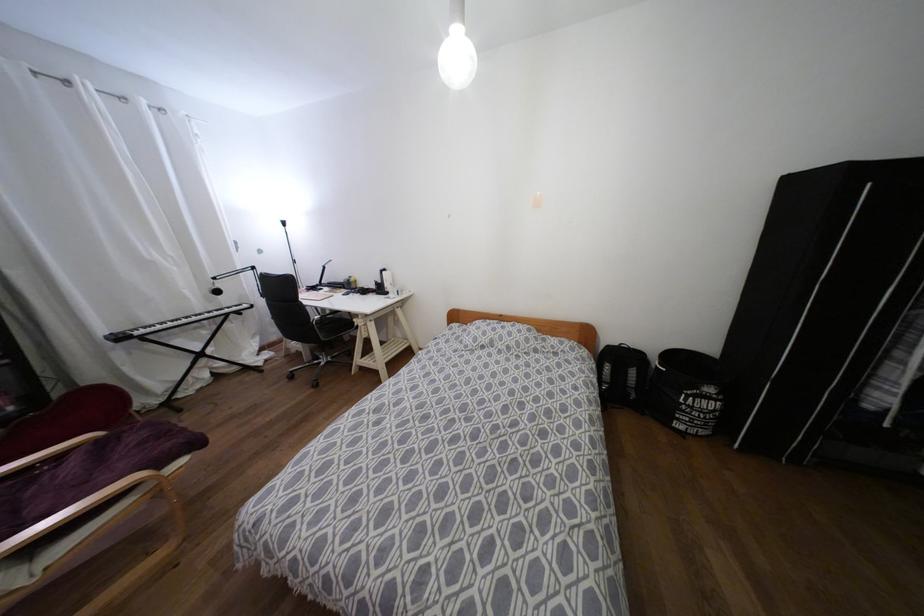
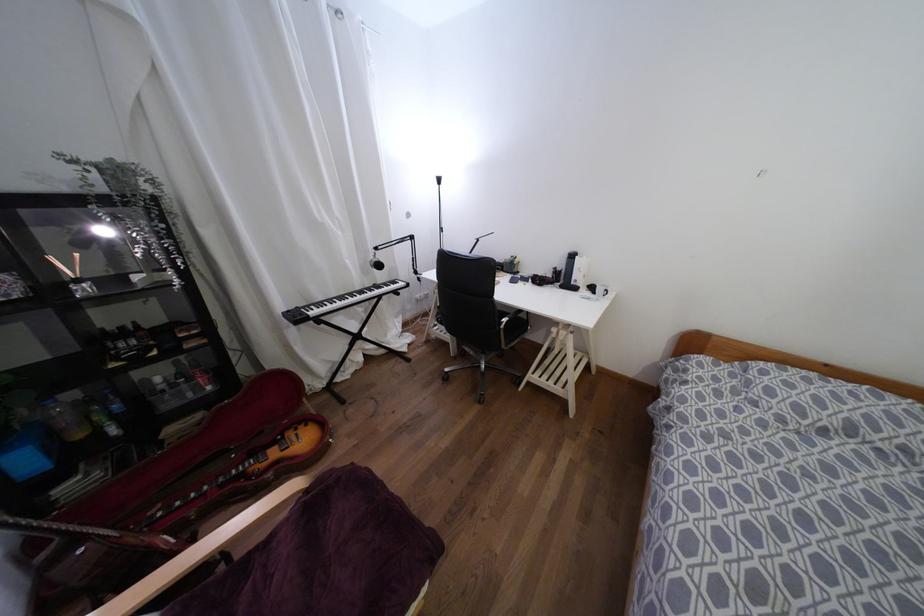
The images are taken continuously from a first-person perspective. In which direction are you moving?

The cameraman moved toward left, forward.